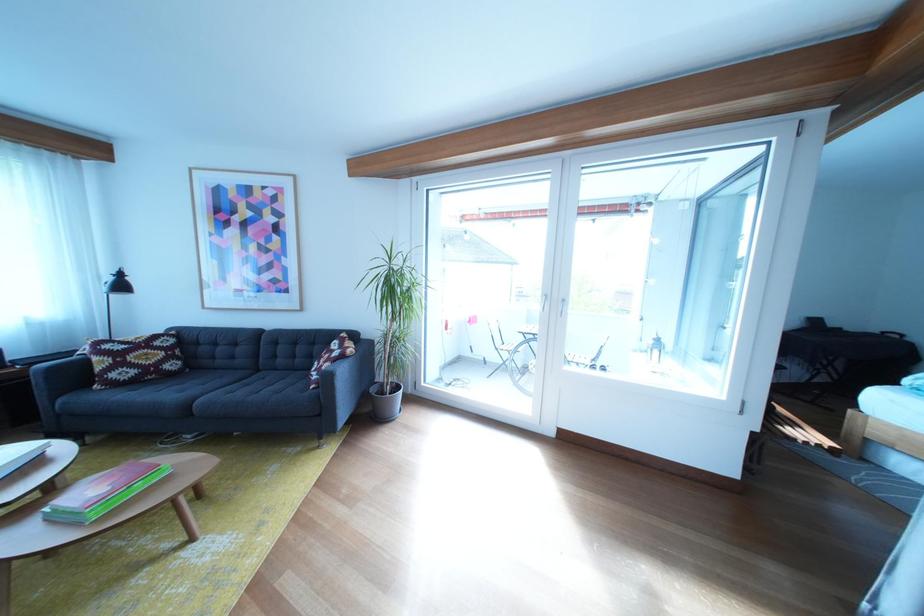
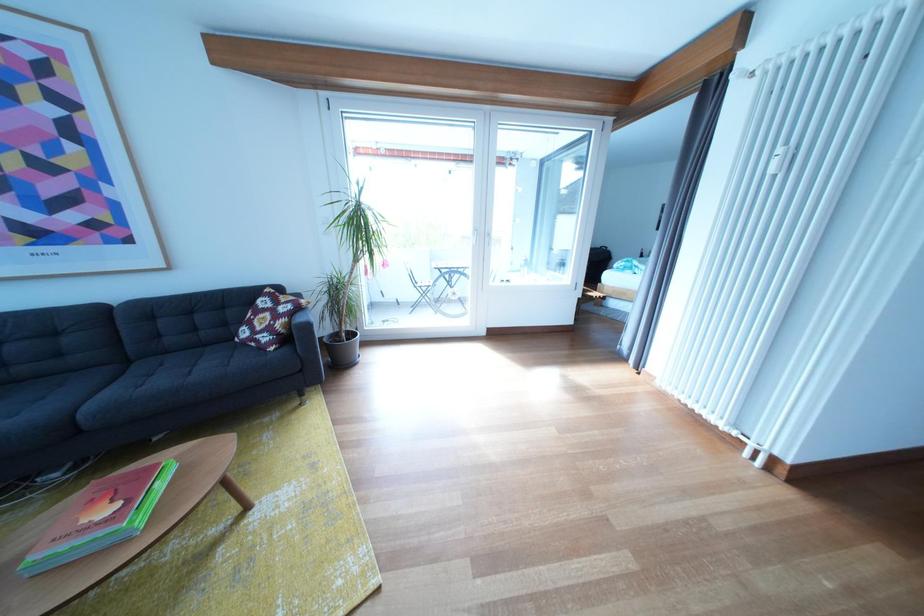
Where in the second image is the point corresponding to (x=272, y=377) from the first image?

(141, 368)